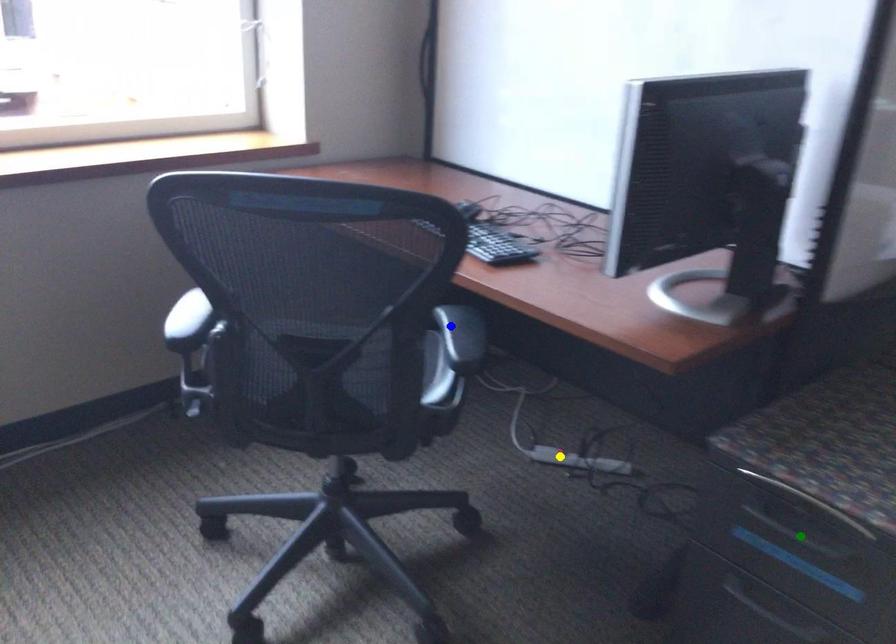
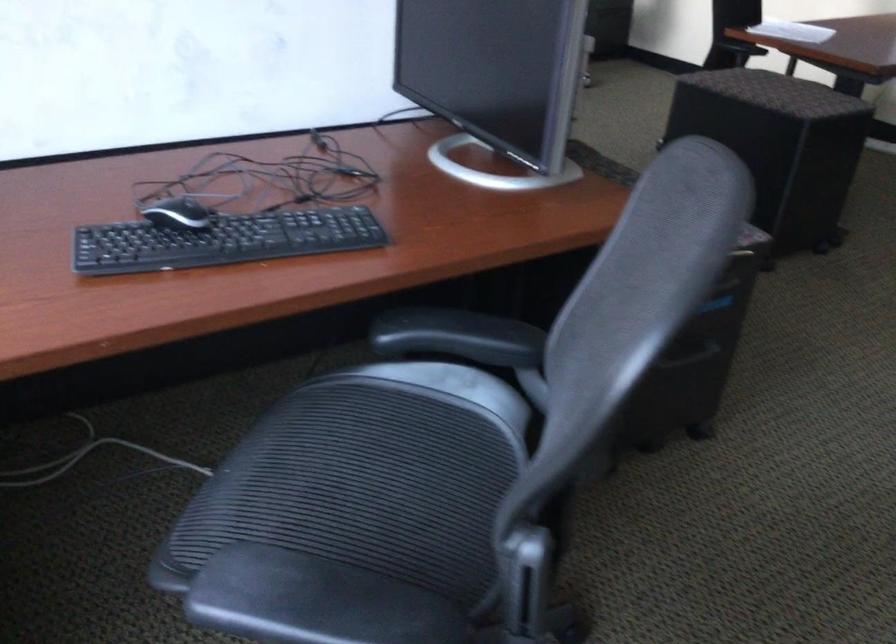
I am providing you with two images of the same scene from different viewpoints. Three points are marked in image1. Which point corresponds to a part or object that is occluded in image2?In image1, three points are marked. Which of them correspond to a part or object that is occluded in image2?Among the three points shown in image1, which one corresponds to a part or object that is no longer visible due to occlusion in image2?

yellow point, green point cannot be seen in image2.